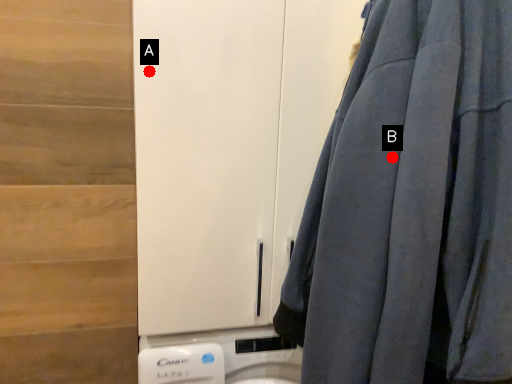
Question: Two points are circled on the image, labeled by A and B beside each circle. Which point is farther to the camera?

Choices:
 (A) A is further
 (B) B is further

Answer: (A)